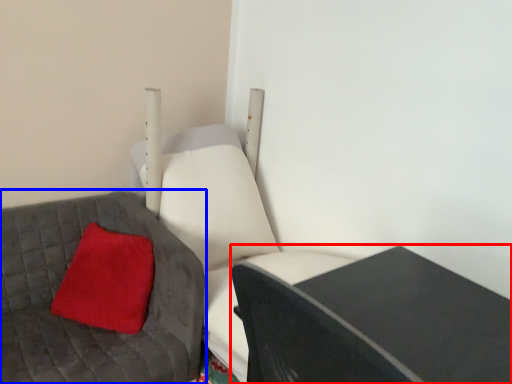
Question: Which object appears closest to the camera in this image, table (highlighted by a red box) or furniture (highlighted by a blue box)?

Choices:
 (A) table
 (B) furniture

Answer: (A)